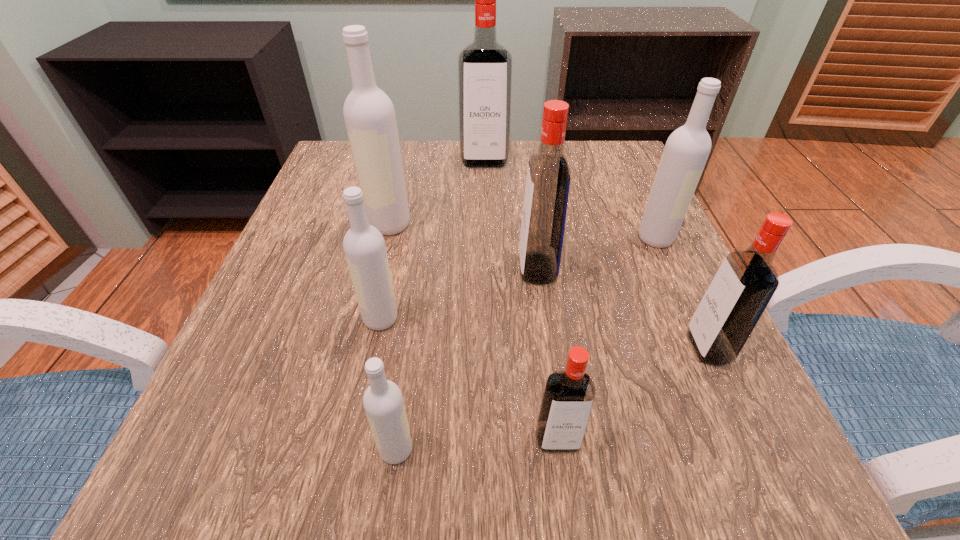
The image size is (960, 540). What are the coordinates of `object that is the fourth closest to the nearest red vodka` in the screenshot? It's located at (364, 246).

Where is `object that can be found as the second closest to the smallest red vodka`? Image resolution: width=960 pixels, height=540 pixels. object that can be found as the second closest to the smallest red vodka is located at coordinates (747, 279).

Locate which vodka ranks sixth in proximity to the fifth nearest vodka. Please provide its 2D coordinates. Your answer should be formatted as a tuple, i.e. [(x, y)], where the tuple contains the x and y coordinates of a point satisfying the conditions above.

[(484, 67)]

Where is `vodka that is the second nearest to the third object from left to right`? The image size is (960, 540). vodka that is the second nearest to the third object from left to right is located at coordinates (364, 246).

Where is `red vodka that can be found as the third closest to the fifth nearest vodka`? red vodka that can be found as the third closest to the fifth nearest vodka is located at coordinates (484, 67).

Locate which red vodka ranks in proximity to the second smallest white vodka. Please provide its 2D coordinates. Your answer should be formatted as a tuple, i.e. [(x, y)], where the tuple contains the x and y coordinates of a point satisfying the conditions above.

[(547, 187)]

Identify which white vodka is the nearest to the rightmost red vodka. Please provide its 2D coordinates. Your answer should be formatted as a tuple, i.e. [(x, y)], where the tuple contains the x and y coordinates of a point satisfying the conditions above.

[(686, 151)]

Where is `white vodka object that ranks as the third closest to the third farthest white vodka`? The height and width of the screenshot is (540, 960). white vodka object that ranks as the third closest to the third farthest white vodka is located at coordinates (686, 151).

In order to click on vacant space that satisfies the following two spatial constraints: 1. on the front and back of the fifth nearest vodka; 2. on the front and back of the nearest red vodka in this screenshot , I will do `click(561, 440)`.